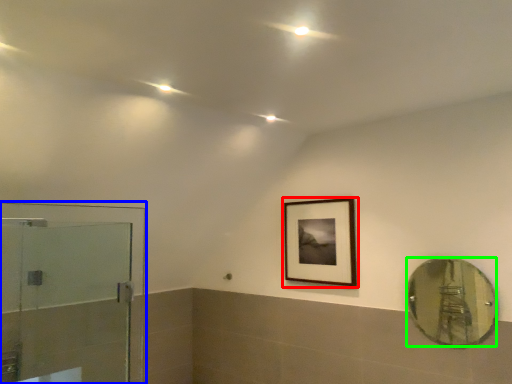
Question: Estimate the real-world distances between objects in this image. Which object is closer to picture frame (highlighted by a red box), screen door (highlighted by a blue box) or mirror (highlighted by a green box)?

Choices:
 (A) screen door
 (B) mirror

Answer: (B)